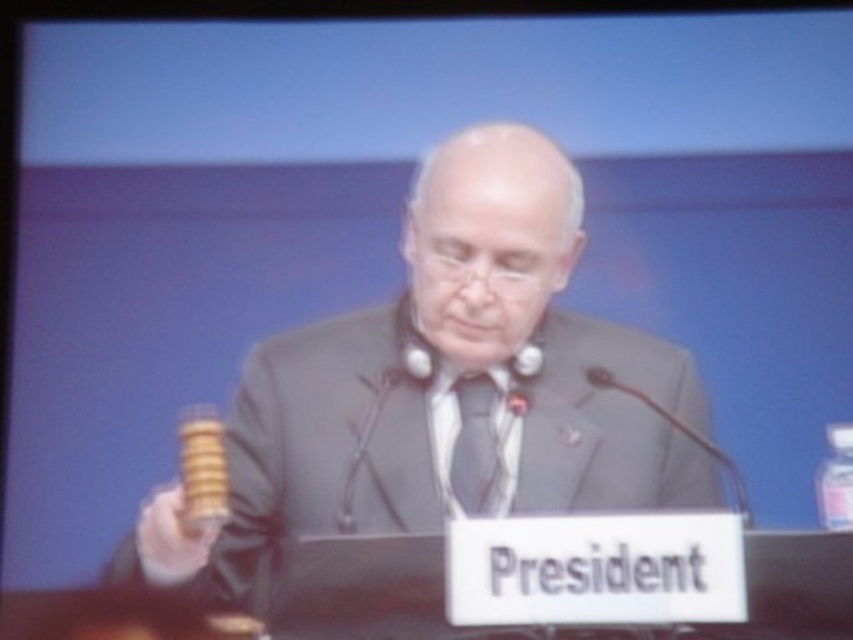
Can you confirm if gray suit at center is smaller than matte gray tie at center?

Actually, gray suit at center might be larger than matte gray tie at center.

Who is taller, gray suit at center or matte gray tie at center?

Standing taller between the two is gray suit at center.

Between point (654, 381) and point (457, 472), which one is positioned behind?

Point (654, 381)

Where is `gray suit at center`? The width and height of the screenshot is (853, 640). gray suit at center is located at coordinates (450, 385).